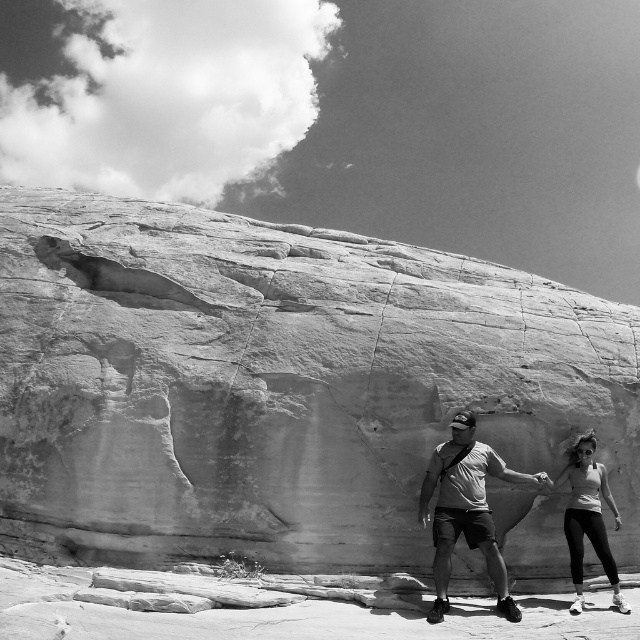
Question: Which object is the closest to the smooth stone rock at center?

Choices:
 (A) matte gray shorts at center
 (B) smooth white tank top at lower right

Answer: (A)

Question: Does smooth stone rock at center have a lesser width compared to smooth white tank top at lower right?

Choices:
 (A) yes
 (B) no

Answer: (B)

Question: Does smooth stone rock at center have a lesser width compared to smooth white tank top at lower right?

Choices:
 (A) no
 (B) yes

Answer: (A)

Question: Which point is closer to the camera?

Choices:
 (A) (573, 579)
 (B) (314, 362)
 (C) (442, 577)

Answer: (C)

Question: Can you confirm if smooth stone rock at center is positioned below matte gray shorts at center?

Choices:
 (A) no
 (B) yes

Answer: (A)

Question: Which point is farther from the camera taking this photo?

Choices:
 (A) (435, 534)
 (B) (593, 464)

Answer: (B)